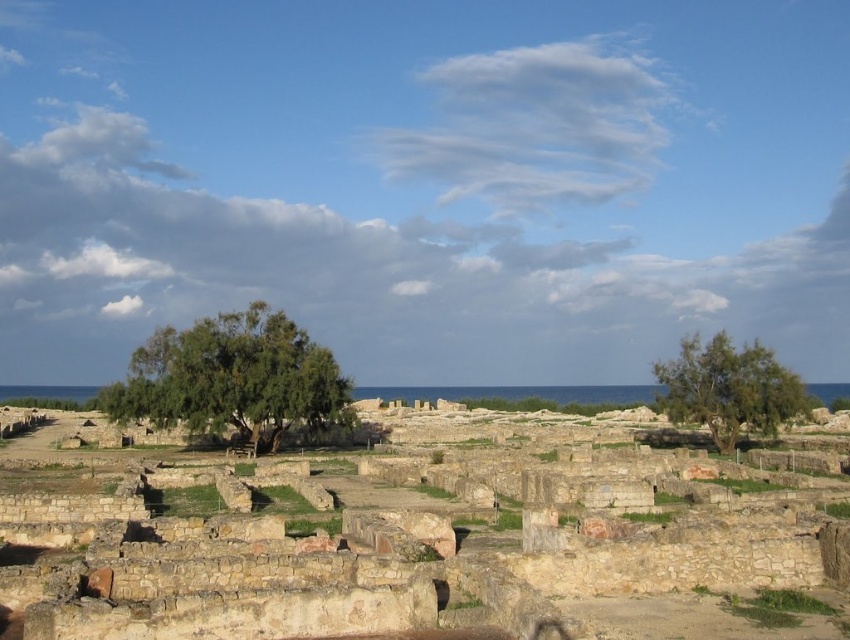
Between brown stone amphitheater at center and green leafy tree at center, which one is positioned lower?

brown stone amphitheater at center

Who is shorter, brown stone amphitheater at center or green leafy tree at center?

brown stone amphitheater at center is shorter.

Locate an element on the screen. The width and height of the screenshot is (850, 640). brown stone amphitheater at center is located at coordinates (387, 557).

You are a GUI agent. You are given a task and a screenshot of the screen. Output one action in this format:
    pyautogui.click(x=<x>, y=<y>)
    Task: Click on the brown stone amphitheater at center
    Image resolution: width=850 pixels, height=640 pixels.
    Given the screenshot: What is the action you would take?
    pyautogui.click(x=387, y=557)

Does green leafy tree at center have a lesser height compared to green leafy tree at right?

Incorrect, green leafy tree at center's height does not fall short of green leafy tree at right's.

Is green leafy tree at center to the left of green leafy tree at right from the viewer's perspective?

Yes, green leafy tree at center is to the left of green leafy tree at right.

Is point (306, 340) less distant than point (751, 410)?

No, it is behind (751, 410).

Image resolution: width=850 pixels, height=640 pixels. Identify the location of green leafy tree at center. (233, 378).

Looking at this image, can you confirm if brown stone amphitheater at center is positioned to the left of green leafy tree at right?

Indeed, brown stone amphitheater at center is positioned on the left side of green leafy tree at right.

Between point (625, 476) and point (732, 387), which one is positioned behind?

The point (732, 387) is behind.

Does point (476, 506) come farther from viewer compared to point (728, 410)?

No, (476, 506) is in front of (728, 410).

Find the location of a particular element. brown stone amphitheater at center is located at coordinates (387, 557).